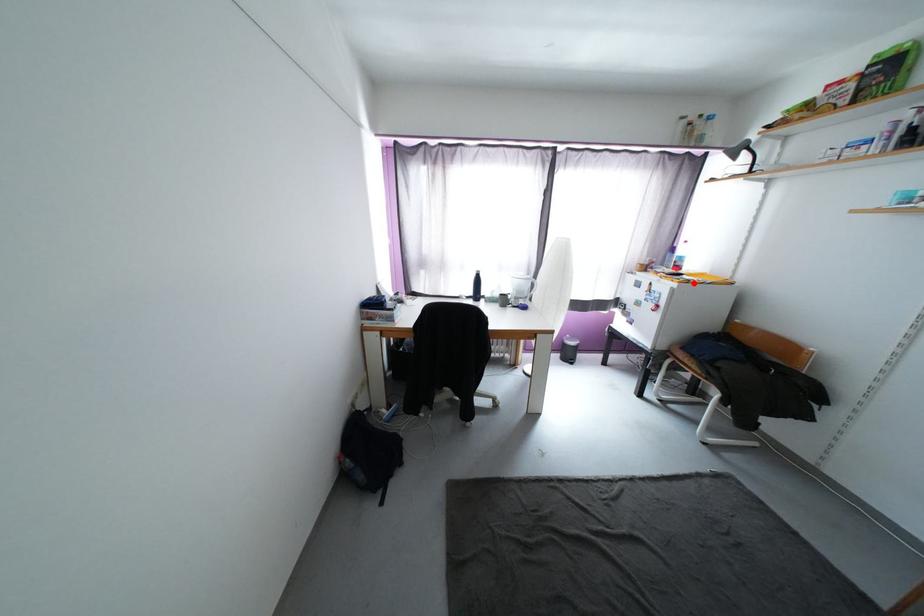
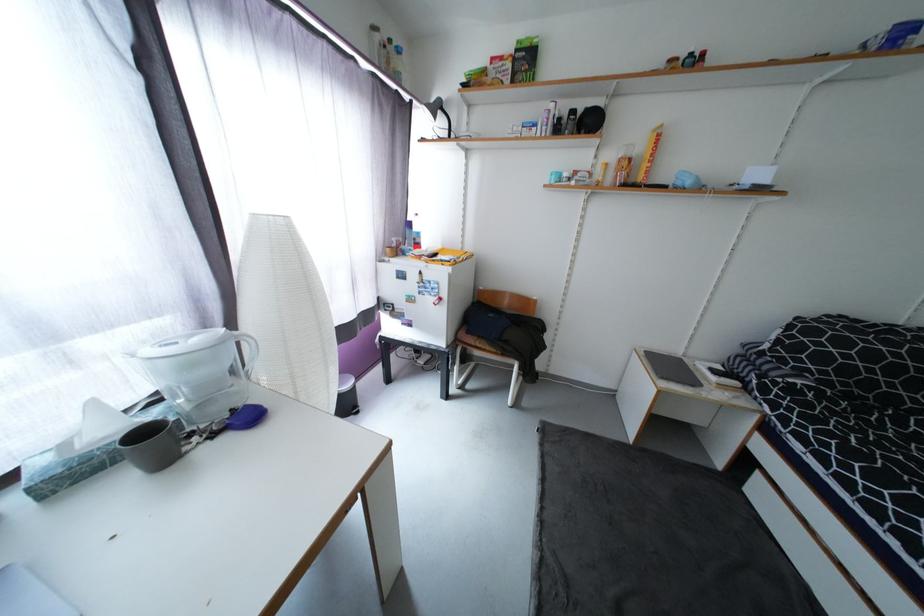
Where in the second image is the point corresponding to the highlighted location from the first image?

(460, 264)